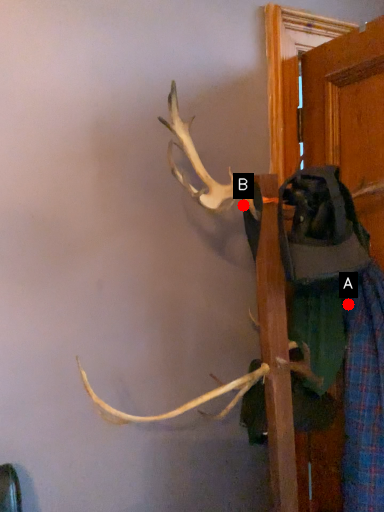
Question: Two points are circled on the image, labeled by A and B beside each circle. Which point is closer to the camera?

Choices:
 (A) A is closer
 (B) B is closer

Answer: (B)